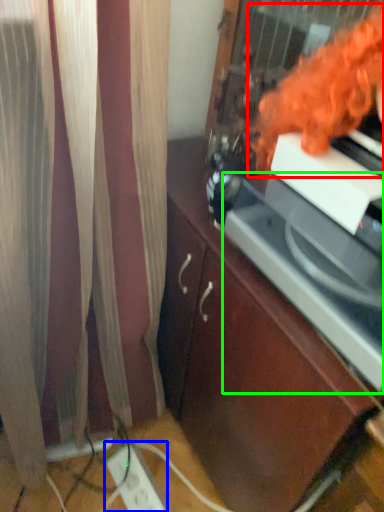
Question: Which object is positioned closest to woman (highlighted by a red box)? Select from extension cord (highlighted by a blue box) and appliance (highlighted by a green box).

Choices:
 (A) extension cord
 (B) appliance

Answer: (B)